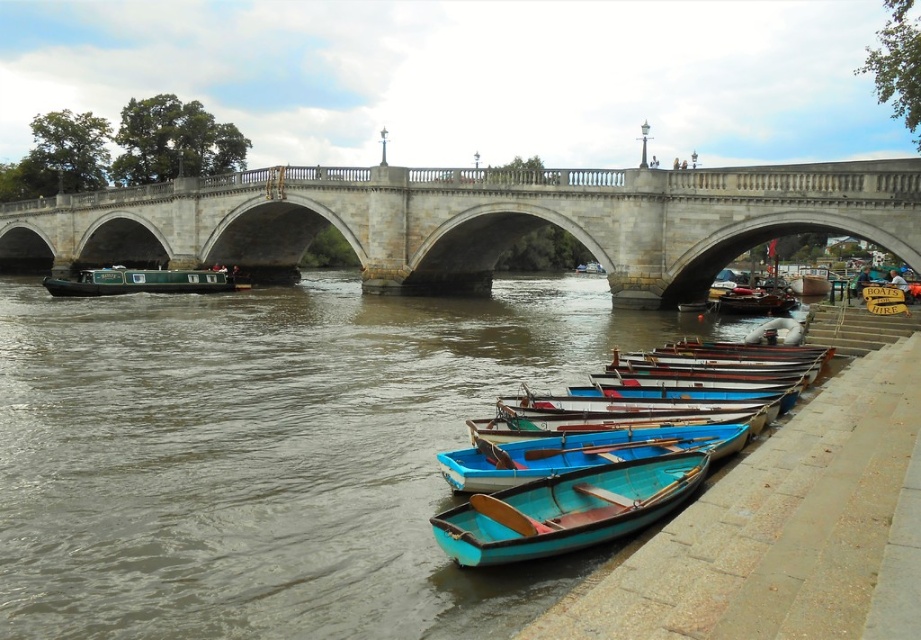
Is teal matte canoe at lower right shorter than teal wooden canoe at lower center?

No, teal matte canoe at lower right is not shorter than teal wooden canoe at lower center.

Measure the distance from teal matte canoe at lower right to teal wooden canoe at lower center.

A distance of 12.09 feet exists between teal matte canoe at lower right and teal wooden canoe at lower center.

You are a GUI agent. You are given a task and a screenshot of the screen. Output one action in this format:
    pyautogui.click(x=<x>, y=<y>)
    Task: Click on the teal matte canoe at lower right
    
    Given the screenshot: What is the action you would take?
    pyautogui.click(x=567, y=509)

Is point (97, 202) positioned behind point (102, 276)?

Yes, point (97, 202) is behind point (102, 276).

Is stone bridge at center thinner than green matte barge at left?

No, stone bridge at center is not thinner than green matte barge at left.

Which is in front, point (132, 202) or point (182, 269)?

Point (182, 269) is in front.

You are a GUI agent. You are given a task and a screenshot of the screen. Output one action in this format:
    pyautogui.click(x=<x>, y=<y>)
    Task: Click on the stone bridge at center
    Image resolution: width=921 pixels, height=640 pixels.
    Given the screenshot: What is the action you would take?
    pyautogui.click(x=472, y=220)

Which is more to the right, stone bridge at center or teal wooden canoe at lower center?

teal wooden canoe at lower center is more to the right.

I want to click on stone bridge at center, so click(472, 220).

I want to click on stone bridge at center, so click(x=472, y=220).